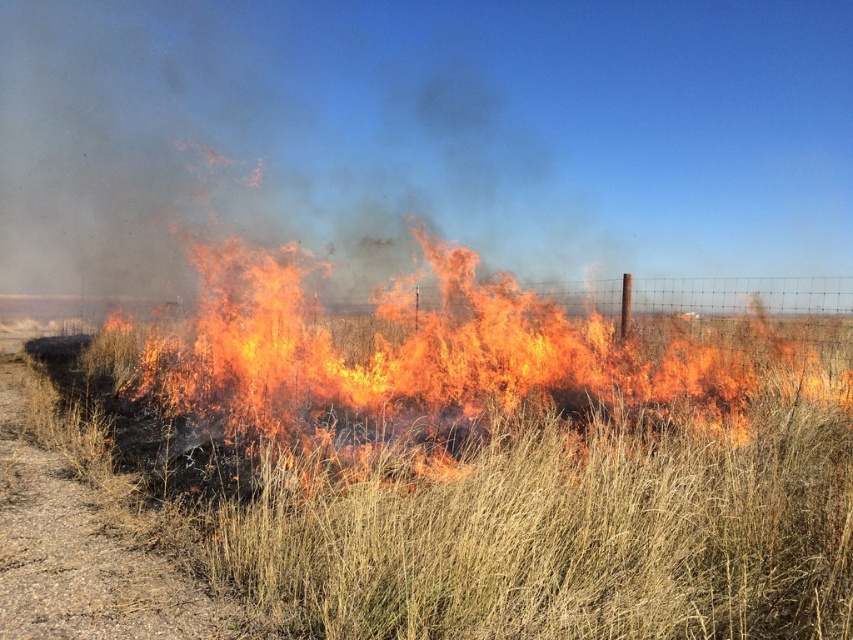
Question: Is grassy field at center bigger than flaming grass at center?

Choices:
 (A) yes
 (B) no

Answer: (B)

Question: Which of the following is the closest to the observer?

Choices:
 (A) grassy field at center
 (B) brown gravel road at lower left
 (C) flaming grass at center

Answer: (A)

Question: Is flaming grass at center wider than brown gravel road at lower left?

Choices:
 (A) no
 (B) yes

Answer: (B)

Question: Where is grassy field at center located in relation to brown gravel road at lower left in the image?

Choices:
 (A) above
 (B) below

Answer: (A)

Question: Which is farther from the grassy field at center?

Choices:
 (A) brown gravel road at lower left
 (B) flaming grass at center

Answer: (A)

Question: Considering the real-world distances, which object is farthest from the brown gravel road at lower left?

Choices:
 (A) flaming grass at center
 (B) grassy field at center

Answer: (A)